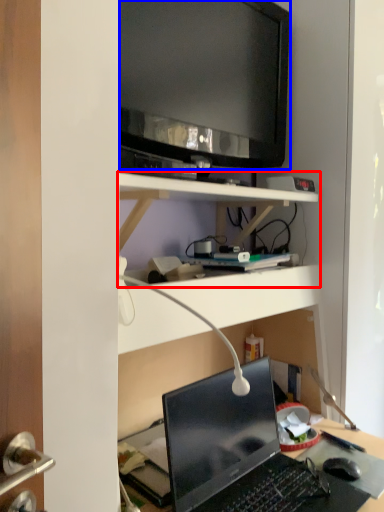
Question: Which point is closer to the camera, shelf (highlighted by a red box) or television (highlighted by a blue box)?

Choices:
 (A) shelf
 (B) television

Answer: (A)